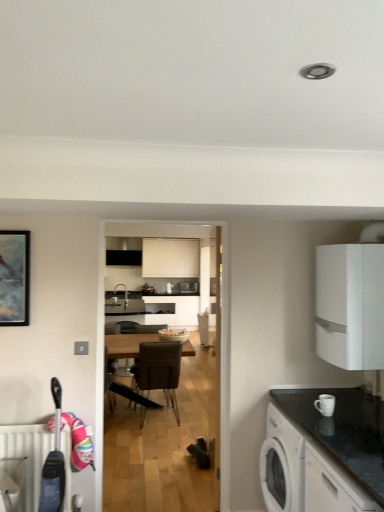
The height and width of the screenshot is (512, 384). Find the location of `free space in front of brown leather chair at center`. free space in front of brown leather chair at center is located at coordinates (150, 435).